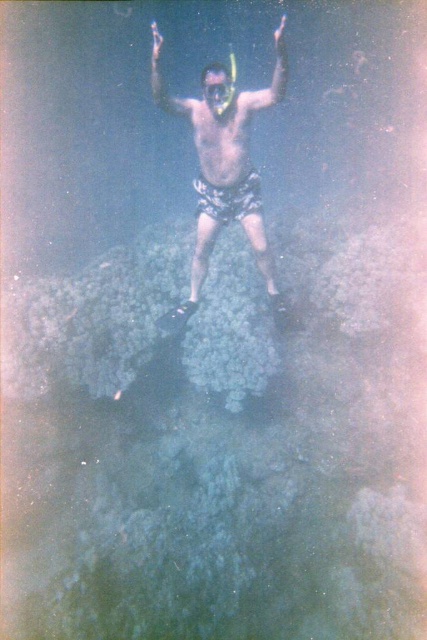
Is smooth skin diver at center behind transparent plastic snorkel at upper center?

Yes, it is.

Does smooth skin diver at center appear over transparent plastic snorkel at upper center?

Actually, smooth skin diver at center is below transparent plastic snorkel at upper center.

Between point (199, 252) and point (155, 52), which one is positioned in front?

Positioned in front is point (155, 52).

Locate an element on the screen. Image resolution: width=427 pixels, height=640 pixels. smooth skin diver at center is located at coordinates (225, 164).